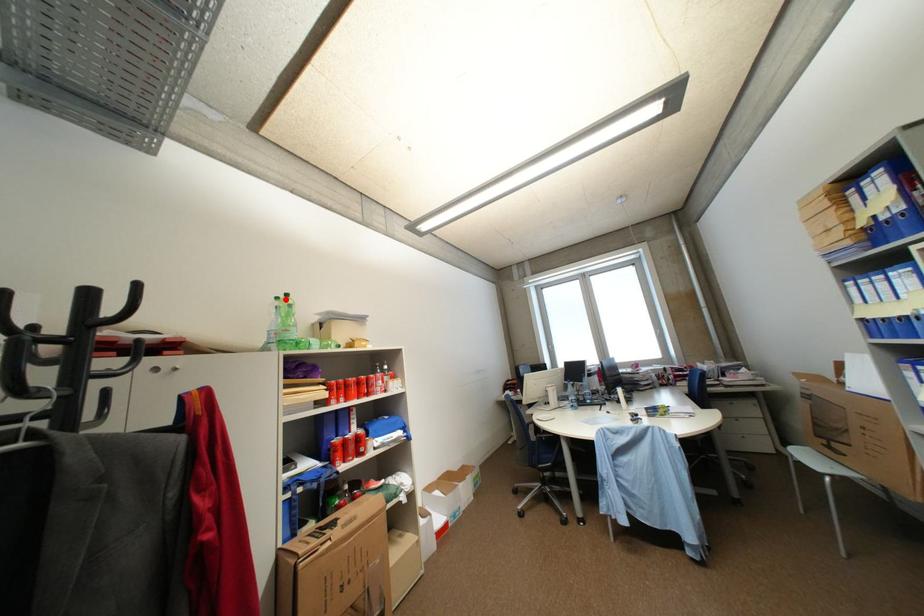
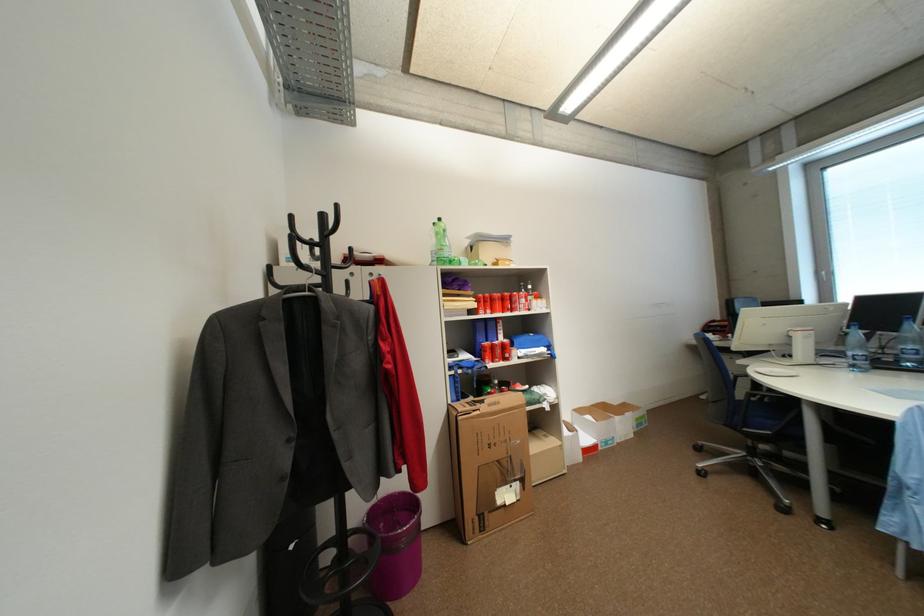
Find the pixel in the second image that matches the highlighted location in the first image.

(443, 225)